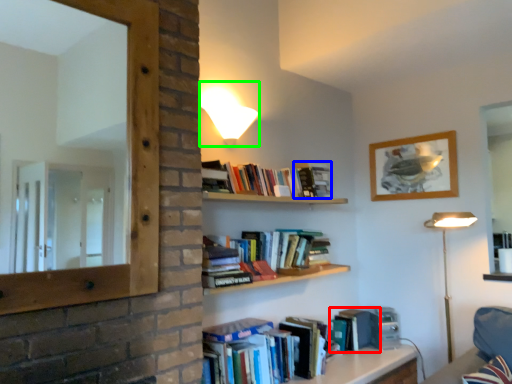
Question: Considering the real-world distances, which object is farthest from paperback book (highlighted by a red box)? paperback book (highlighted by a blue box) or lamp (highlighted by a green box)?

Choices:
 (A) paperback book
 (B) lamp

Answer: (B)